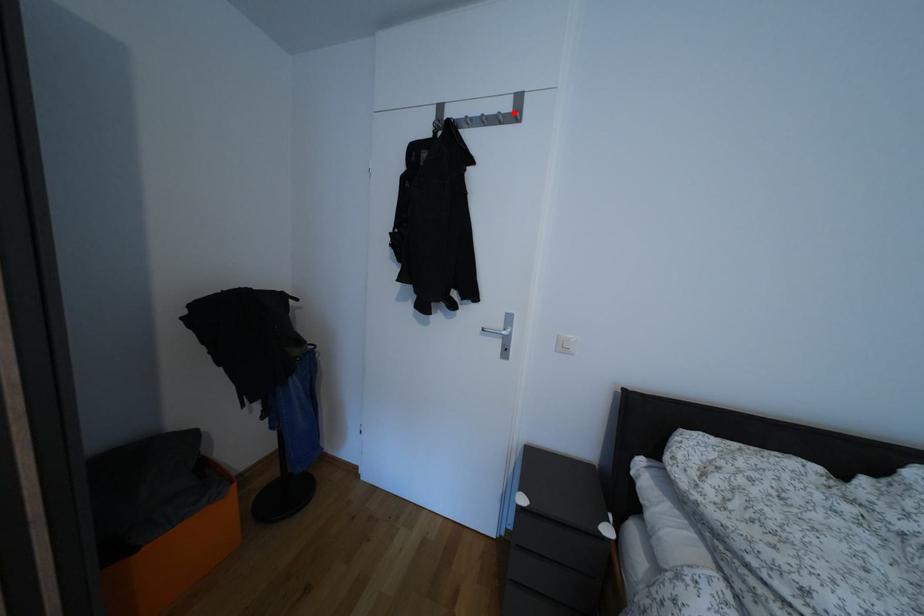
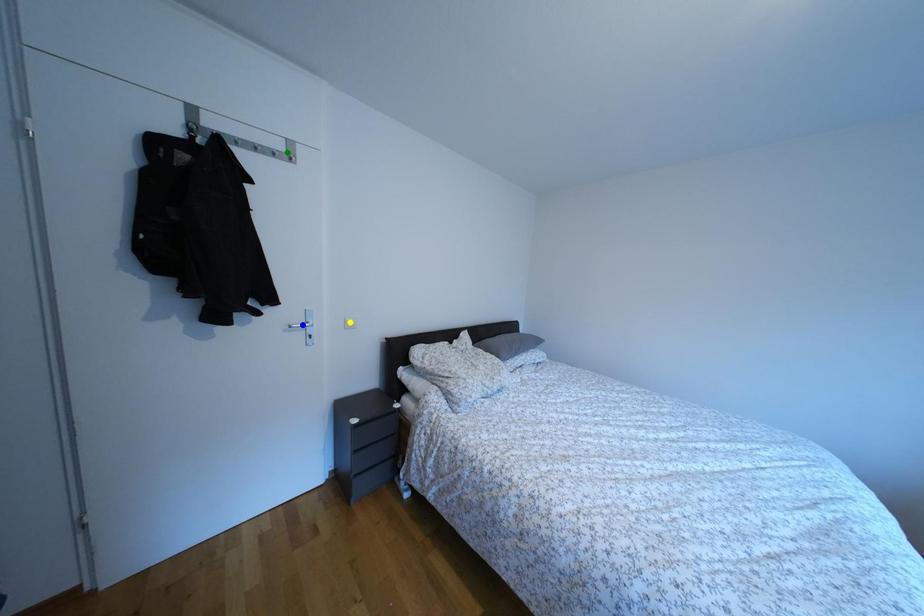
Question: I am providing you with two images of the same scene from different viewpoints. A red point is marked on the first image. You are given multiple points on the second image. Which point in image 2 is actually the same real-world point as the red point in image 1?

Choices:
 (A) green point
 (B) yellow point
 (C) blue point

Answer: (A)